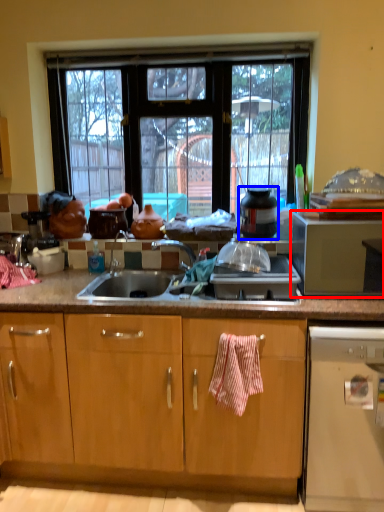
Question: Which object appears closest to the camera in this image, microwave oven (highlighted by a red box) or appliance (highlighted by a blue box)?

Choices:
 (A) microwave oven
 (B) appliance

Answer: (A)